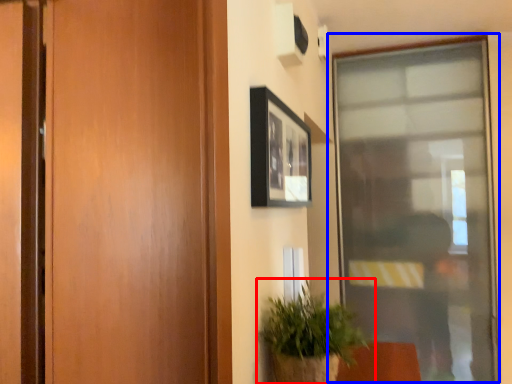
Question: Which object appears closest to the camera in this image, houseplant (highlighted by a red box) or window (highlighted by a blue box)?

Choices:
 (A) houseplant
 (B) window

Answer: (A)